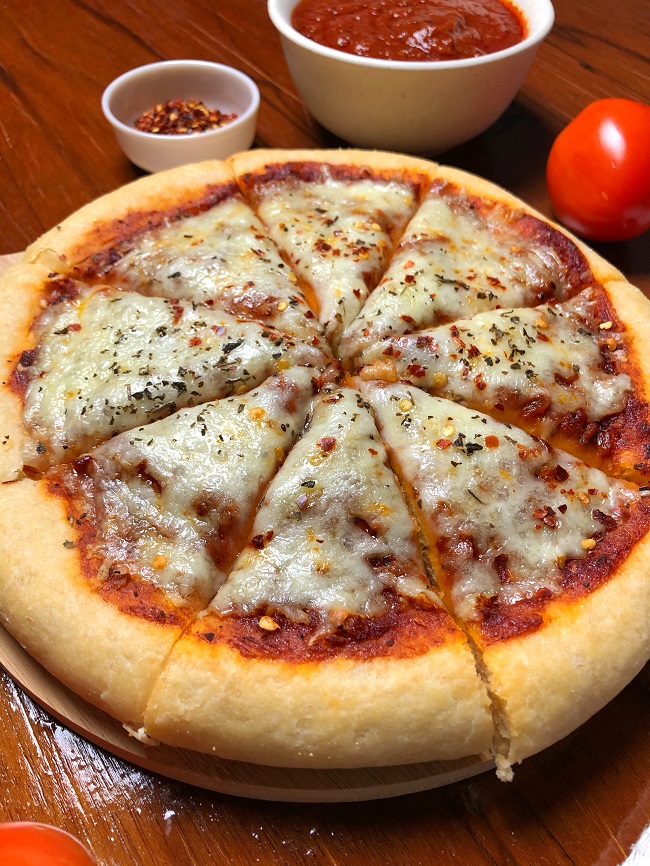
Locate an element on the screen. The height and width of the screenshot is (866, 650). handle is located at coordinates (8, 243).